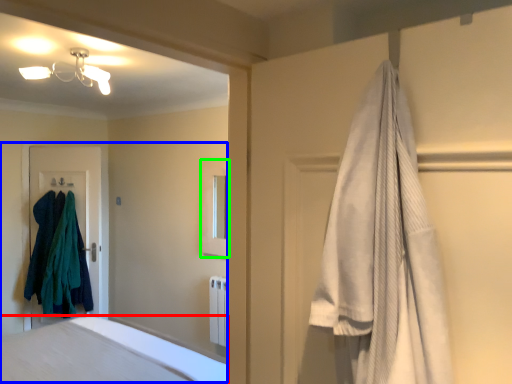
Question: Estimate the real-world distances between objects in this image. Which object is closer to bathtub (highlighted by a red box), bed (highlighted by a blue box) or medicine cabinet (highlighted by a green box)?

Choices:
 (A) bed
 (B) medicine cabinet

Answer: (B)